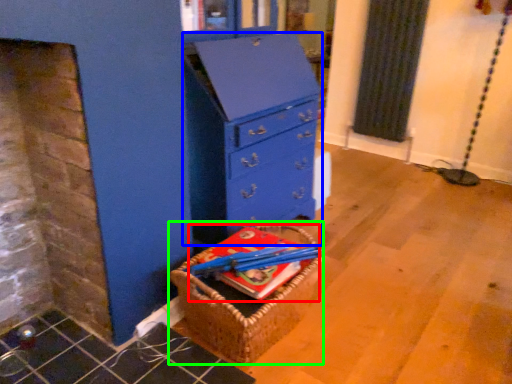
Question: Which object is the farthest from book (highlighted by a red box)? Choose among these: chest of drawers (highlighted by a blue box) or basket (highlighted by a green box).

Choices:
 (A) chest of drawers
 (B) basket

Answer: (A)